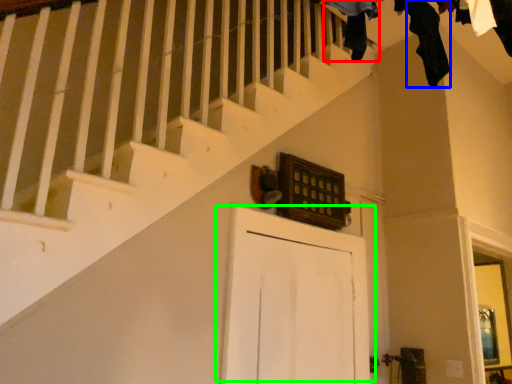
Question: Which object is the farthest from clothing (highlighted by a red box)? Choose among these: clothing (highlighted by a blue box) or door (highlighted by a green box).

Choices:
 (A) clothing
 (B) door

Answer: (B)